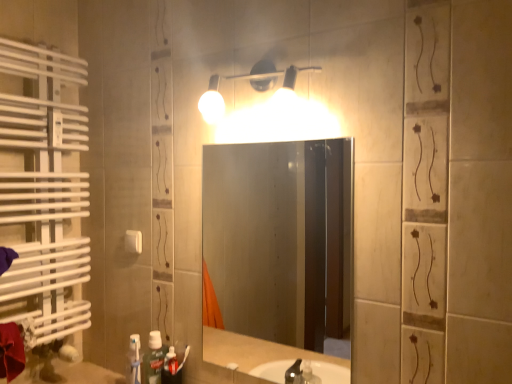
Question: Is matte white light fixture at upper center at the back of white plastic light switch at upper center?

Choices:
 (A) no
 (B) yes

Answer: (A)

Question: Does white plastic light switch at upper center have a larger size compared to matte white light fixture at upper center?

Choices:
 (A) yes
 (B) no

Answer: (B)

Question: Is white plastic light switch at upper center closer to the viewer compared to matte white light fixture at upper center?

Choices:
 (A) yes
 (B) no

Answer: (B)

Question: Is white plastic light switch at upper center to the left of matte white light fixture at upper center from the viewer's perspective?

Choices:
 (A) no
 (B) yes

Answer: (B)

Question: Can you confirm if white plastic light switch at upper center is taller than matte white light fixture at upper center?

Choices:
 (A) no
 (B) yes

Answer: (A)

Question: Would you say smooth glass mirror at center is inside or outside white plastic light switch at upper center?

Choices:
 (A) inside
 (B) outside

Answer: (B)

Question: From a real-world perspective, is smooth glass mirror at center above or below white plastic light switch at upper center?

Choices:
 (A) below
 (B) above

Answer: (A)

Question: Does point (293, 188) appear closer or farther from the camera than point (124, 238)?

Choices:
 (A) farther
 (B) closer

Answer: (A)

Question: Is smooth glass mirror at center wider or thinner than white plastic light switch at upper center?

Choices:
 (A) wide
 (B) thin

Answer: (A)

Question: Is smooth glass mirror at center taller or shorter than green matte toothpaste at lower left?

Choices:
 (A) tall
 (B) short

Answer: (A)

Question: From the image's perspective, is smooth glass mirror at center positioned above or below green matte toothpaste at lower left?

Choices:
 (A) above
 (B) below

Answer: (A)

Question: From a real-world perspective, is smooth glass mirror at center positioned above or below green matte toothpaste at lower left?

Choices:
 (A) above
 (B) below

Answer: (A)

Question: Based on their positions, is smooth glass mirror at center located to the left or right of green matte toothpaste at lower left?

Choices:
 (A) left
 (B) right

Answer: (B)

Question: Is point (156, 360) closer or farther from the camera than point (216, 74)?

Choices:
 (A) farther
 (B) closer

Answer: (A)

Question: From a real-world perspective, is green matte toothpaste at lower left above or below matte white light fixture at upper center?

Choices:
 (A) above
 (B) below

Answer: (B)